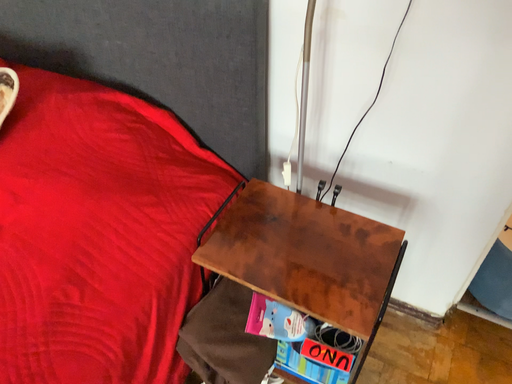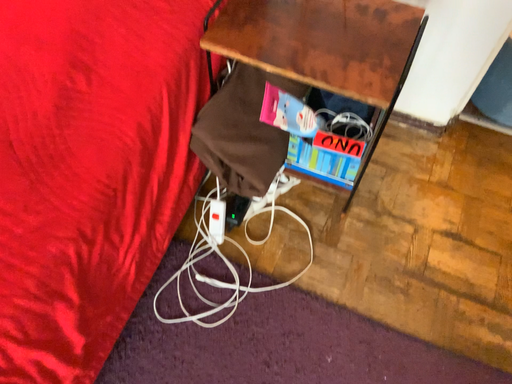
Question: Which way did the camera rotate in the video?

Choices:
 (A) rotated downward
 (B) rotated upward

Answer: (A)